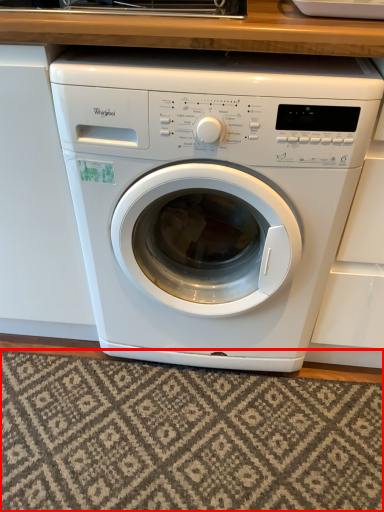
Question: From the image's perspective, where is mat (annotated by the red box) located relative to washing machine?

Choices:
 (A) below
 (B) above

Answer: (A)